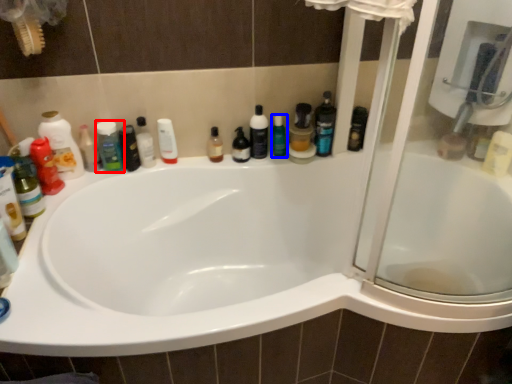
Question: Which point is closer to the camera, toiletry (highlighted by a red box) or cleaning product (highlighted by a blue box)?

Choices:
 (A) toiletry
 (B) cleaning product

Answer: (A)